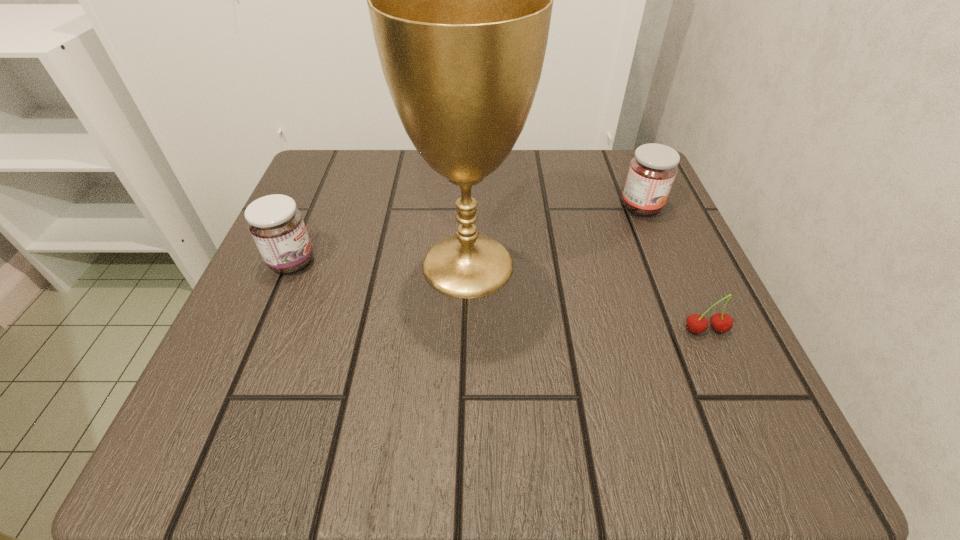
Where is `trophy cup`? This screenshot has height=540, width=960. trophy cup is located at coordinates (460, 0).

Locate an element on the screen. The width and height of the screenshot is (960, 540). the tallest object is located at coordinates coord(460,0).

Where is `the right jam`? the right jam is located at coordinates (652, 171).

Locate an element on the screen. This screenshot has height=540, width=960. the farther jam is located at coordinates (652, 171).

Where is `the nearer jam`? the nearer jam is located at coordinates (276, 224).

Locate an element on the screen. the leftmost object is located at coordinates pos(276,224).

At what (x,y) coordinates should I click in order to perform the action: click on the nearest object. Please return your answer as a coordinate pair (x, y). Looking at the image, I should click on (720, 322).

Identify the location of the shortest object. (720, 322).

Where is `vacant region located on the front of the trophy cup`? vacant region located on the front of the trophy cup is located at coordinates (465, 370).

Locate an element on the screen. The height and width of the screenshot is (540, 960). vacant area situated on the front of the farthest object is located at coordinates (692, 329).